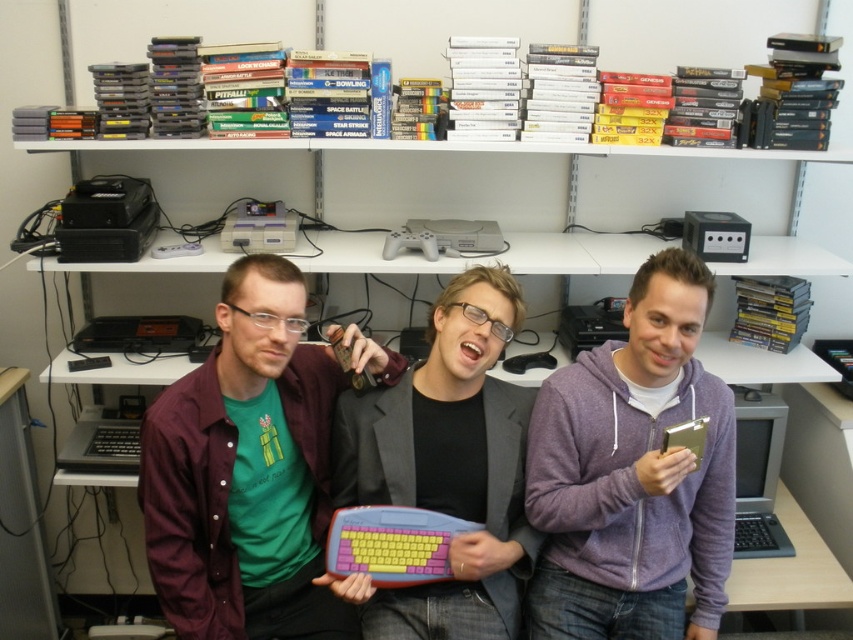
Question: Which point is farther to the camera?

Choices:
 (A) (350, 428)
 (B) (744, 412)
 (C) (155, 433)
 (D) (619, 477)

Answer: (B)

Question: Estimate the real-world distances between objects in this image. Which object is farther from the rubberized plastic keyboard at center?

Choices:
 (A) green matte shirt at center
 (B) silver metallic monitor at lower right

Answer: (B)

Question: Is purple fleece hoodie at center closer to the viewer compared to silver metallic monitor at lower right?

Choices:
 (A) yes
 (B) no

Answer: (A)

Question: Is purple fleece hoodie at center smaller than rubberized plastic keyboard at center?

Choices:
 (A) no
 (B) yes

Answer: (A)

Question: Which point is farther from the camera taking this photo?

Choices:
 (A) (729, 568)
 (B) (397, 598)
 (C) (312, 410)

Answer: (A)

Question: Can you confirm if rubberized plastic keyboard at center is thinner than silver metallic monitor at lower right?

Choices:
 (A) no
 (B) yes

Answer: (A)